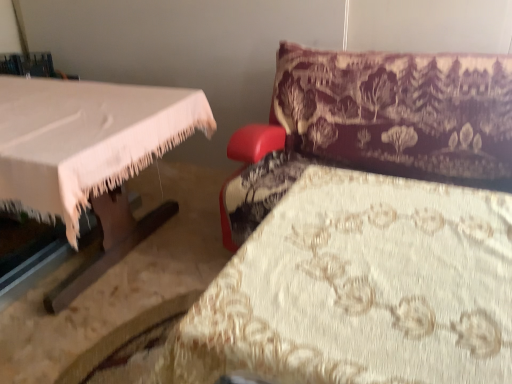
Question: From the image's perspective, is velvet-like burgundy couch at upper right over floral cream fabric at lower right?

Choices:
 (A) yes
 (B) no

Answer: (A)

Question: Is velvet-like burgundy couch at upper right not inside floral cream fabric at lower right?

Choices:
 (A) yes
 (B) no

Answer: (A)

Question: Does velvet-like burgundy couch at upper right have a lesser width compared to floral cream fabric at lower right?

Choices:
 (A) yes
 (B) no

Answer: (B)

Question: From a real-world perspective, is velvet-like burgundy couch at upper right over floral cream fabric at lower right?

Choices:
 (A) no
 (B) yes

Answer: (B)

Question: Would you say velvet-like burgundy couch at upper right is a long distance from floral cream fabric at lower right?

Choices:
 (A) no
 (B) yes

Answer: (A)

Question: Does velvet-like burgundy couch at upper right touch floral cream fabric at lower right?

Choices:
 (A) yes
 (B) no

Answer: (B)

Question: From a real-world perspective, is floral cream fabric at lower right below velvet-like burgundy couch at upper right?

Choices:
 (A) no
 (B) yes

Answer: (B)

Question: Is floral cream fabric at lower right next to velvet-like burgundy couch at upper right?

Choices:
 (A) yes
 (B) no

Answer: (B)

Question: Is floral cream fabric at lower right facing towards velvet-like burgundy couch at upper right?

Choices:
 (A) yes
 (B) no

Answer: (B)

Question: From the image's perspective, does floral cream fabric at lower right appear higher than velvet-like burgundy couch at upper right?

Choices:
 (A) no
 (B) yes

Answer: (A)

Question: From a real-world perspective, is floral cream fabric at lower right located higher than velvet-like burgundy couch at upper right?

Choices:
 (A) yes
 (B) no

Answer: (B)

Question: Is floral cream fabric at lower right taller than velvet-like burgundy couch at upper right?

Choices:
 (A) yes
 (B) no

Answer: (A)

Question: In the image, is floral cream fabric at lower right on the left side or the right side of velvet-like burgundy couch at upper right?

Choices:
 (A) left
 (B) right

Answer: (A)